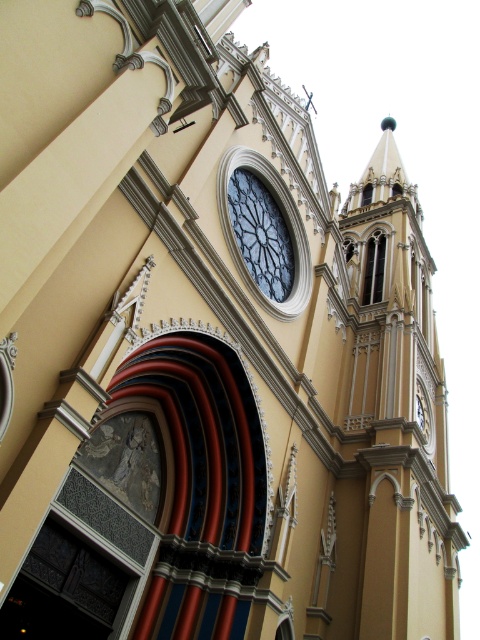
Does gold polished stone tower at upper right come behind dark glass clock at center?

No, gold polished stone tower at upper right is in front of dark glass clock at center.

Who is shorter, gold polished stone tower at upper right or dark glass clock at center?

dark glass clock at center

Does point (391, 547) come farther from viewer compared to point (262, 188)?

No.

Identify the location of gold polished stone tower at upper right. This screenshot has height=640, width=480. (398, 410).